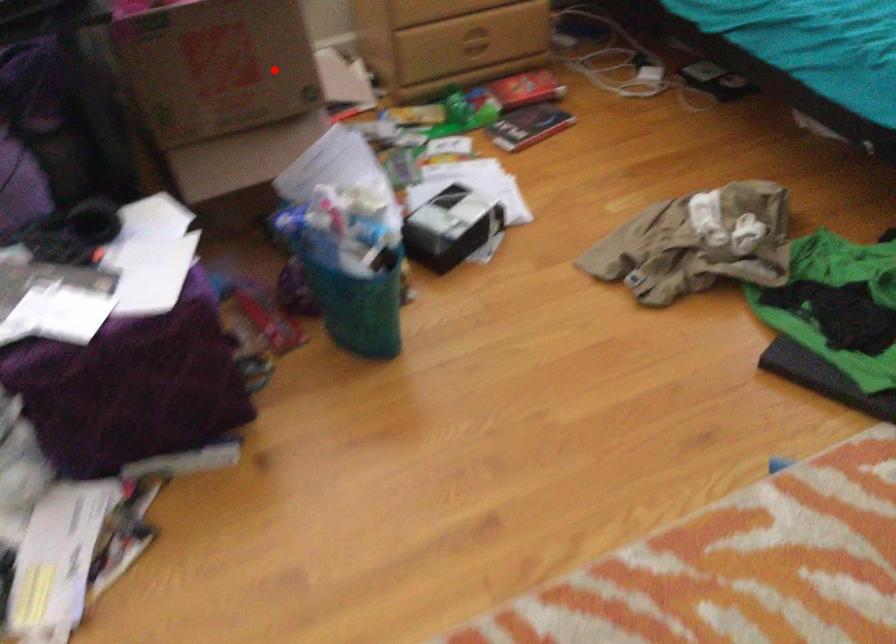
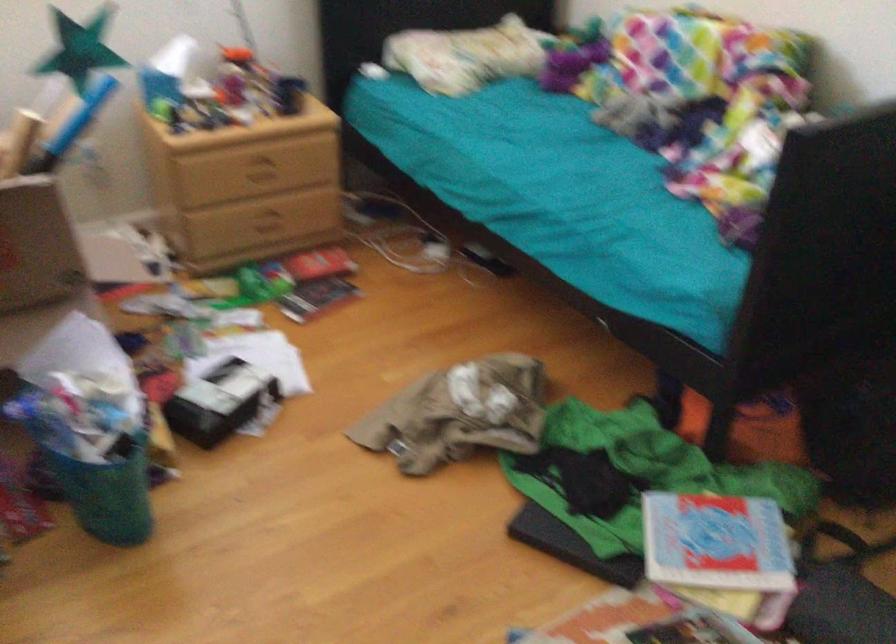
Locate, in the second image, the point that corresponds to the highlighted location in the first image.

(36, 245)